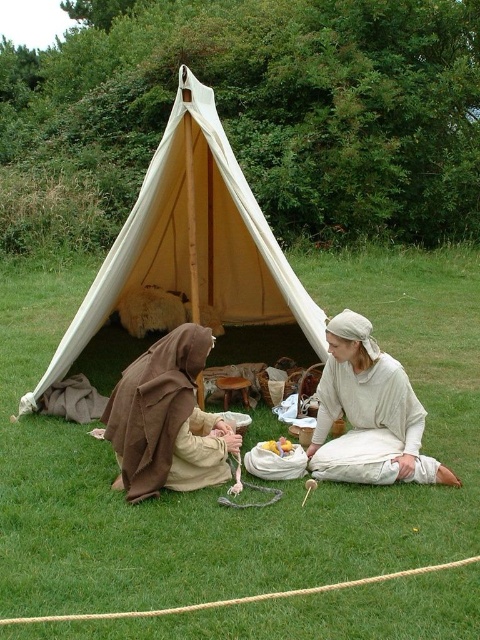
You are planning to set up a picnic blanket between the green grass at center and the light beige fabric at center. Given that the distance between them is 36.67 inches, will a standard picnic blanket measuring 60 inches in length fit without overlapping either object?

The distance between the green grass at center and light beige fabric at center is 36.67 inches. A standard picnic blanket measuring 60 inches in length is longer than the available space, so it will overlap both objects.

You are planning to set up a picnic in the area shown. You have a large blanket that covers the entire green grass at center. Can the beige canvas tent at center also fit on the same area without overlapping?

The green grass at center is bigger than the beige canvas tent at center, so yes, the beige canvas tent at center can fit on the same area without overlapping since the grass area is larger.

You are standing at the entrance of the tent and want to place a small potted plant exactly at the center of the green grass at center. According to the coordinates provided, where should you place the plant?

The green grass at center is located at coordinates point (x=226, y=484), so you should place the plant there.